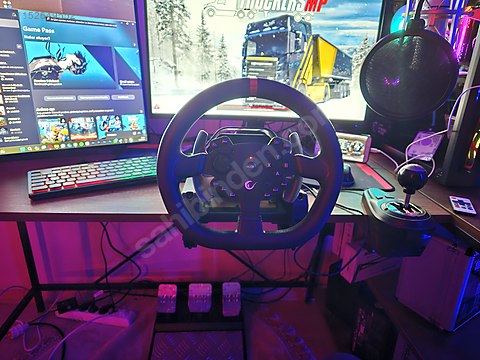
You are a GUI agent. You are given a task and a screenshot of the screen. Output one action in this format:
    pyautogui.click(x=<x>, y=<y>)
    Task: Click on the powerstrip
    Image resolution: width=480 pixels, height=360 pixels.
    Given the screenshot: What is the action you would take?
    pyautogui.click(x=95, y=316)